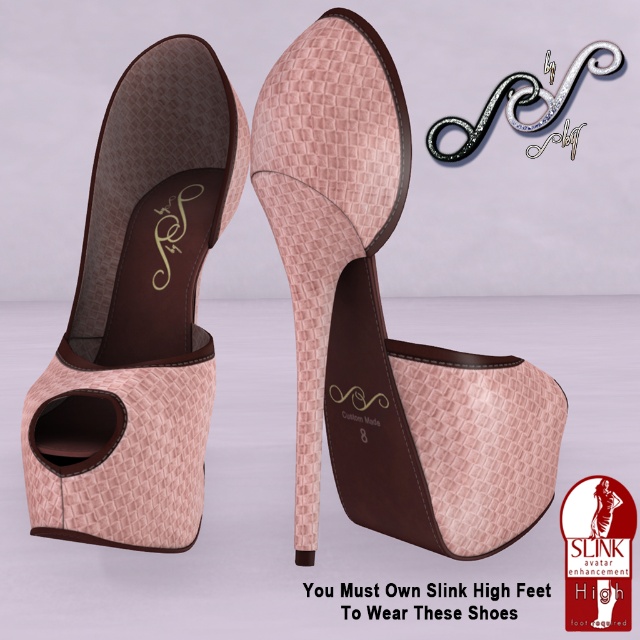
Question: Estimate the real-world distances between objects in this image. Which object is farther from the pink textured high heel at center?

Choices:
 (A) pink woven leather sandal at left
 (B) pink textured heel at center

Answer: (A)

Question: Which object appears farthest from the camera in this image?

Choices:
 (A) pink textured heel at center
 (B) pink textured high heel at center
 (C) pink woven leather sandal at left

Answer: (A)

Question: Is pink woven leather sandal at left thinner than pink textured heel at center?

Choices:
 (A) yes
 (B) no

Answer: (B)

Question: Can you confirm if pink textured high heel at center is wider than pink woven leather sandal at left?

Choices:
 (A) no
 (B) yes

Answer: (B)

Question: Considering the real-world distances, which object is farthest from the pink woven leather sandal at left?

Choices:
 (A) pink textured heel at center
 (B) pink textured high heel at center

Answer: (A)

Question: Can you confirm if pink woven leather sandal at left is positioned above pink textured heel at center?

Choices:
 (A) yes
 (B) no

Answer: (A)